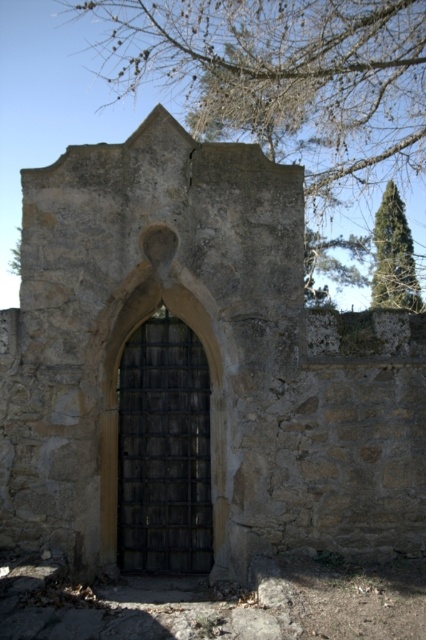
You are standing 2 meters away from the base of the ancient stone structure. You want to touch the bare branches at upper center. Can you reach them without climbing?

The bare branches at upper center are 7.79 meters away from the camera. Since you are already 2 meters away from the structure, the branches are still 5.79 meters away from you. You cannot reach them without climbing.

You are an architect examining an ancient stone structure. You notice two elements in the upper part of the image. One is bare branches at upper center and the other is green coniferous tree at upper right. Which of these two elements is located to the left of the other?

The bare branches at upper center is positioned on the left side of green coniferous tree at upper right.